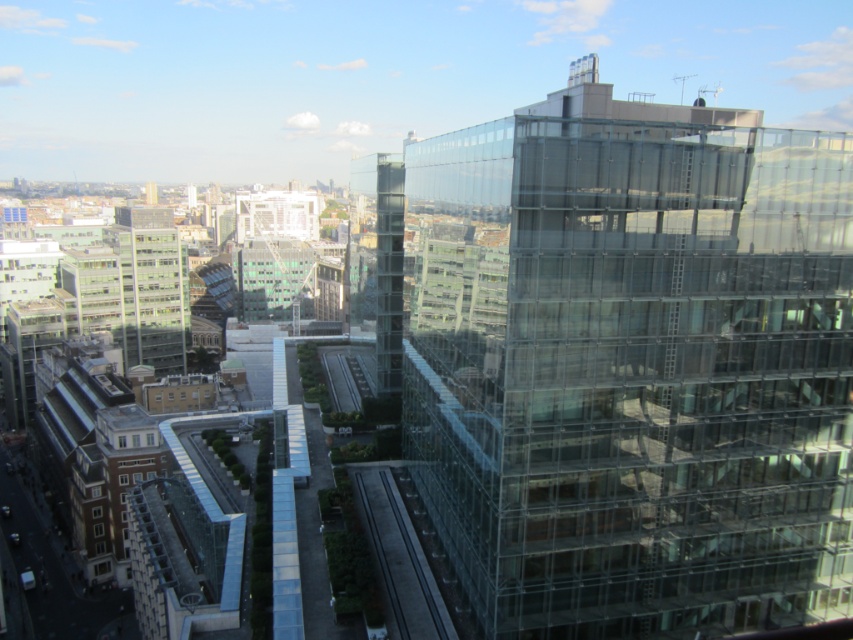
Question: Is transparent glass building at right in front of transparent glass elevator at center?

Choices:
 (A) no
 (B) yes

Answer: (B)

Question: Which object appears closest to the camera in this image?

Choices:
 (A) transparent glass building at right
 (B) transparent glass elevator at center

Answer: (A)

Question: Among these points, which one is nearest to the camera?

Choices:
 (A) (379, 154)
 (B) (584, 156)

Answer: (B)

Question: Where is transparent glass building at right located in relation to transparent glass elevator at center in the image?

Choices:
 (A) below
 (B) above

Answer: (A)

Question: Is transparent glass building at right further to camera compared to transparent glass elevator at center?

Choices:
 (A) no
 (B) yes

Answer: (A)